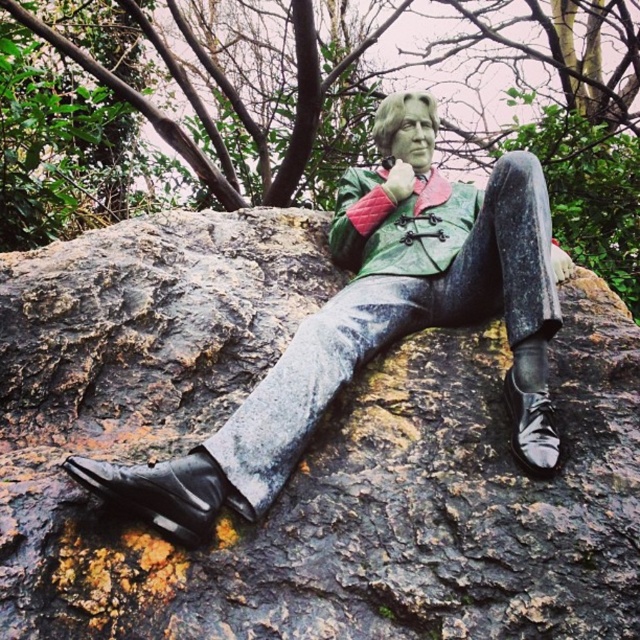
Who is more distant from viewer, (349, 198) or (540, 401)?

The point (349, 198) is more distant.

Who is taller, green quilted jacket at center or shiny black shoe at lower right?

With more height is green quilted jacket at center.

Measure the distance between green quilted jacket at center and camera.

green quilted jacket at center is 1.83 meters from camera.

You are a GUI agent. You are given a task and a screenshot of the screen. Output one action in this format:
    pyautogui.click(x=<x>, y=<y>)
    Task: Click on the green quilted jacket at center
    The height and width of the screenshot is (640, 640).
    Given the screenshot: What is the action you would take?
    pyautogui.click(x=400, y=224)

Can you confirm if shiny black shoes at lower left is positioned to the right of shiny black shoe at lower right?

In fact, shiny black shoes at lower left is to the left of shiny black shoe at lower right.

The width and height of the screenshot is (640, 640). Describe the element at coordinates (371, 316) in the screenshot. I see `shiny black shoes at lower left` at that location.

In order to click on shiny black shoes at lower left in this screenshot , I will do `click(371, 316)`.

Does black patent leather shoe at lower left appear on the left side of shiny black shoe at lower right?

Correct, you'll find black patent leather shoe at lower left to the left of shiny black shoe at lower right.

Can you confirm if black patent leather shoe at lower left is positioned above shiny black shoe at lower right?

No, black patent leather shoe at lower left is not above shiny black shoe at lower right.

Is point (224, 492) less distant than point (545, 387)?

Yes, point (224, 492) is in front of point (545, 387).

Where is `black patent leather shoe at lower left`? This screenshot has width=640, height=640. black patent leather shoe at lower left is located at coordinates (161, 492).